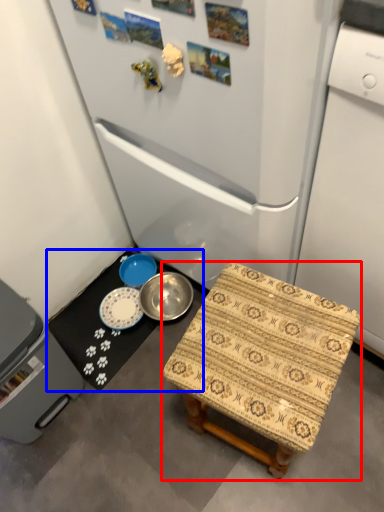
Question: Which point is further to the camera, furniture (highlighted by a red box) or table (highlighted by a blue box)?

Choices:
 (A) furniture
 (B) table

Answer: (B)